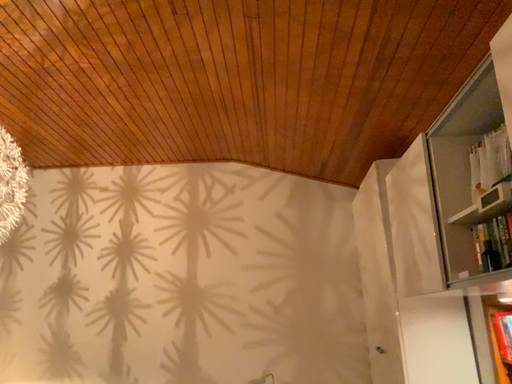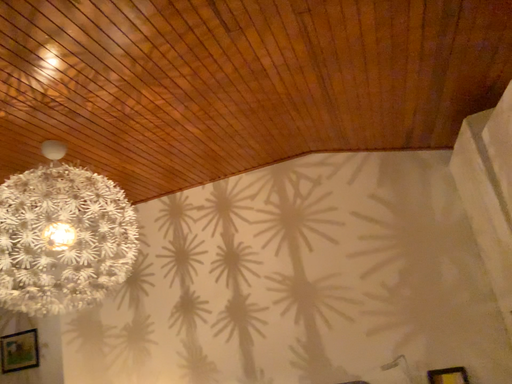
Question: Which way did the camera rotate in the video?

Choices:
 (A) rotated right
 (B) rotated left

Answer: (B)